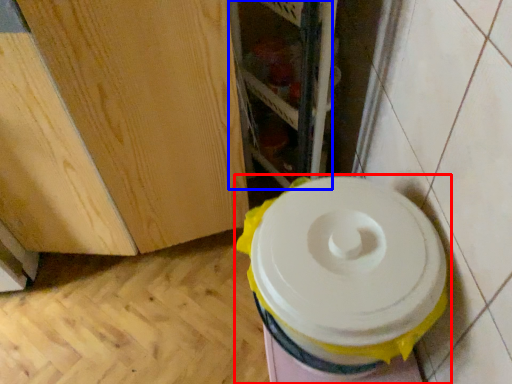
Question: Which point is further to the camera, toilet (highlighted by a red box) or shelf (highlighted by a blue box)?

Choices:
 (A) toilet
 (B) shelf

Answer: (B)